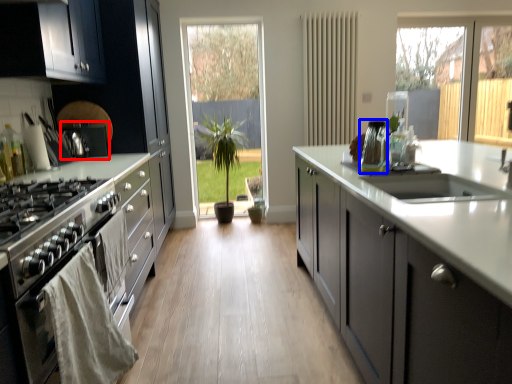
Question: Which object is further to the camera taking this photo, appliance (highlighted by a red box) or appliance (highlighted by a blue box)?

Choices:
 (A) appliance
 (B) appliance

Answer: (A)